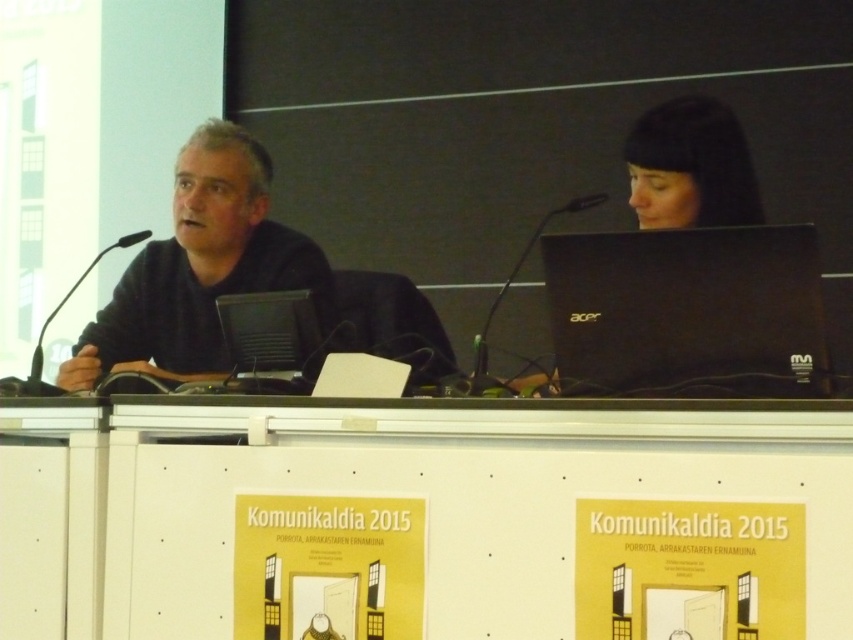
You are organizing a conference and need to choose a microphone for a speaker who requires a wider base for stability. Based on the image, which microphone between the black plastic microphone at center and the black plastic microphone at left should you select?

The black plastic microphone at left has a greater width compared to the black plastic microphone at center, so you should select the black plastic microphone at left for better stability.